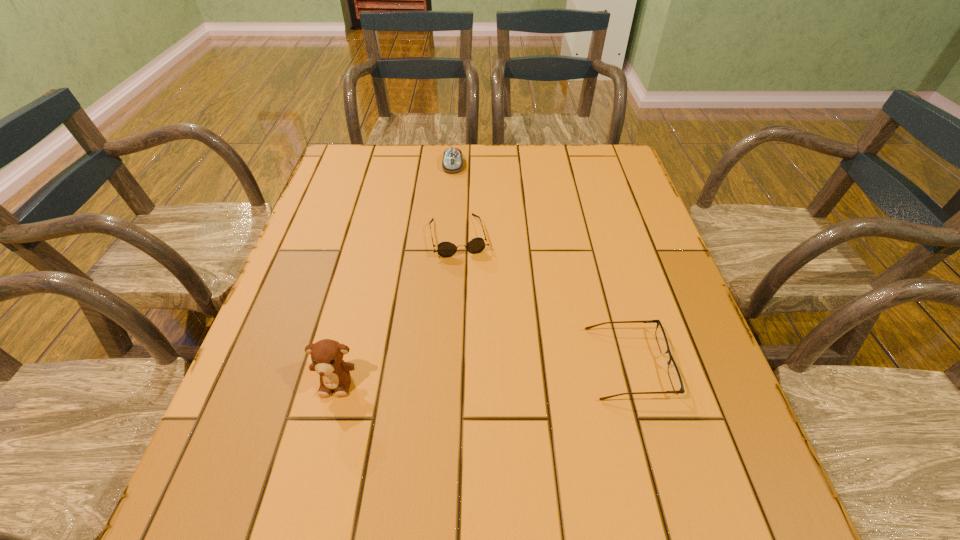
Where is `unoccupied area between the teddy bear and the computer mouse`? unoccupied area between the teddy bear and the computer mouse is located at coordinates (395, 273).

The image size is (960, 540). Identify the location of object that can be found as the third closest to the computer mouse. (327, 355).

Where is `object that is the third closest to the leftmost object`? object that is the third closest to the leftmost object is located at coordinates (452, 162).

This screenshot has width=960, height=540. I want to click on free location that satisfies the following two spatial constraints: 1. on the front side of the rightmost object; 2. on the front-facing side of the second farthest object, so click(452, 363).

Find the location of a particular element. The width and height of the screenshot is (960, 540). vacant point that satisfies the following two spatial constraints: 1. on the front side of the farthest object; 2. on the front-facing side of the spectacles is located at coordinates (438, 363).

The width and height of the screenshot is (960, 540). In order to click on free location that satisfies the following two spatial constraints: 1. on the front side of the spectacles; 2. on the front-facing side of the second farthest object in this screenshot , I will do `click(452, 363)`.